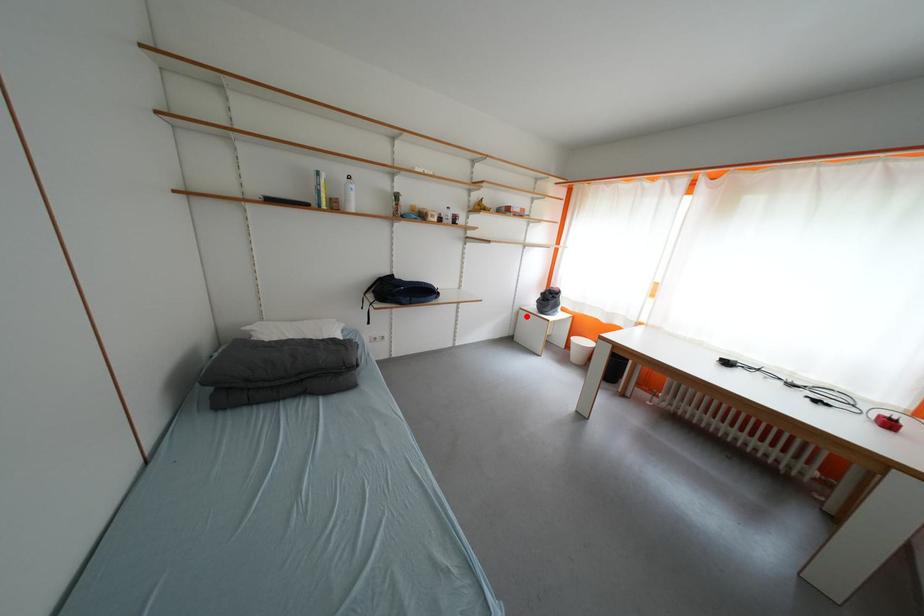
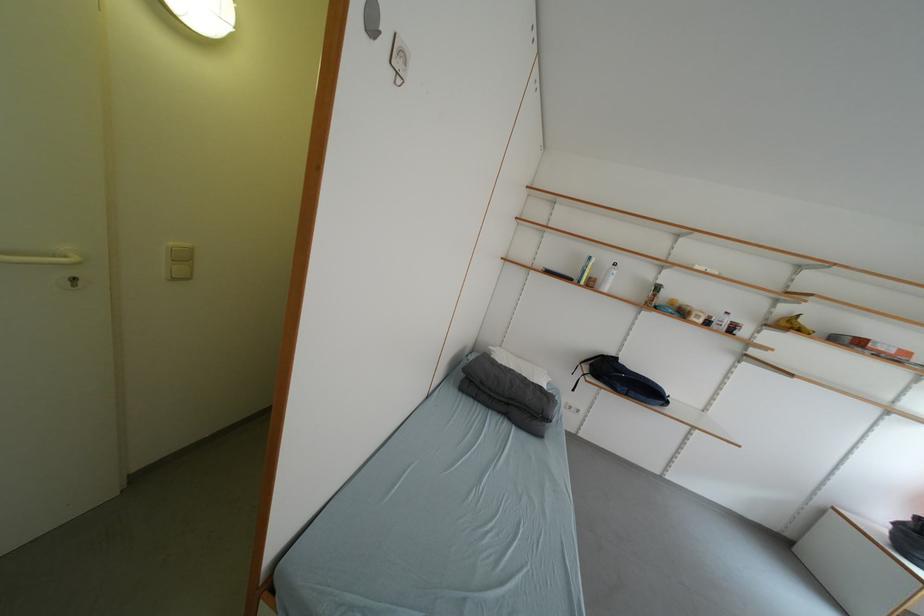
Question: I am providing you with two images of the same scene from different viewpoints. A red point is shown in image1. For the corresponding object point in image2, is it positioned nearer or farther from the camera?

Choices:
 (A) Nearer
 (B) Farther

Answer: (B)